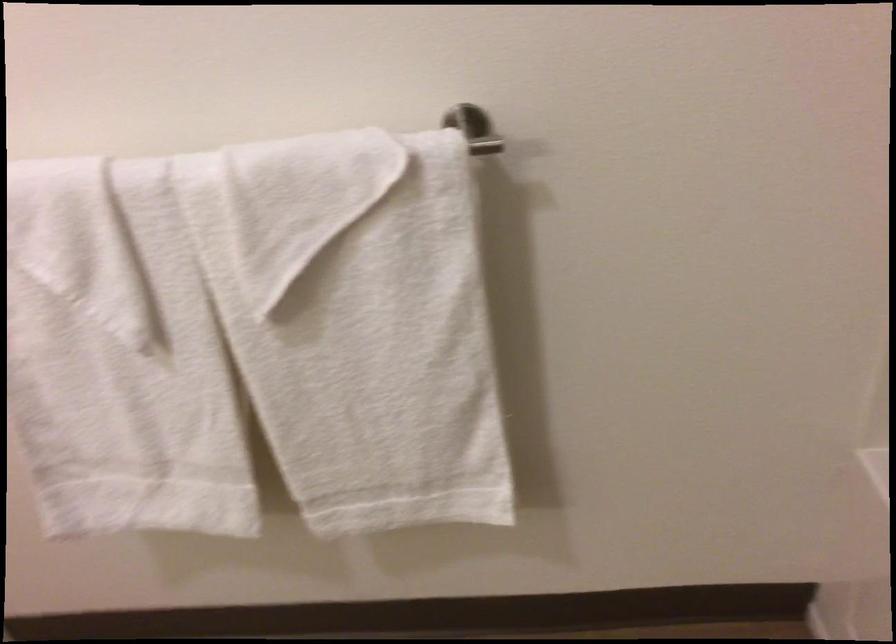
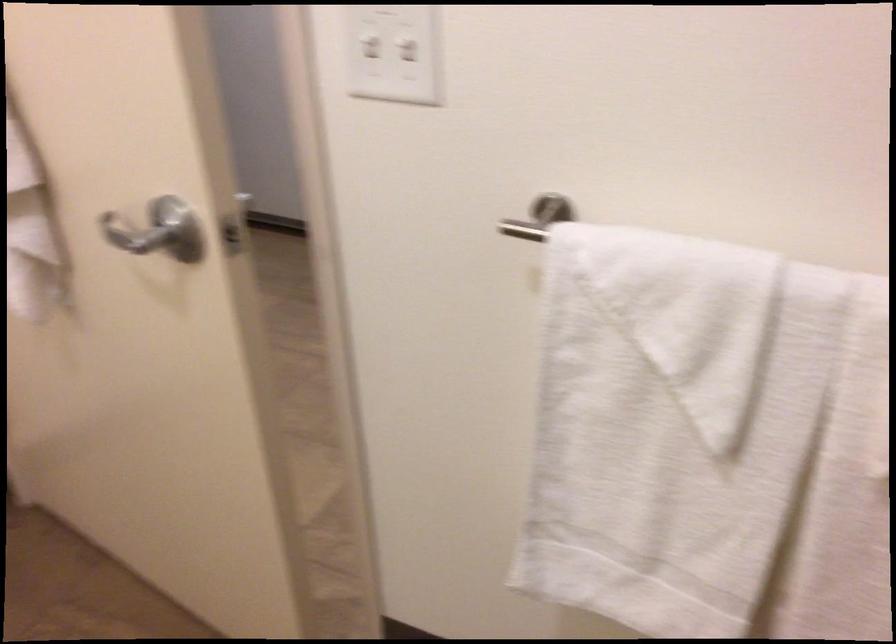
Question: Which direction would the cameraman need to move to produce the second image? Reply with the corresponding letter.

Choices:
 (A) Left
 (B) Right
 (C) Forward
 (D) Backward

Answer: (A)